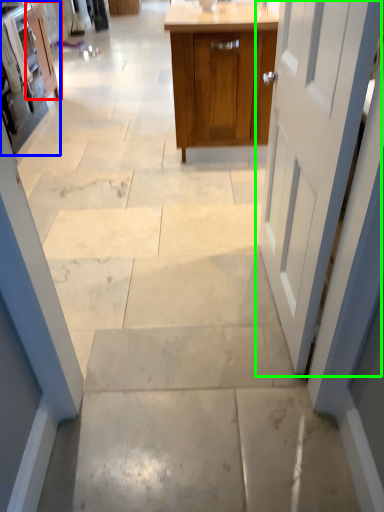
Question: Considering the real-world distances, which object is farthest from cabinetry (highlighted by a red box)? cabinetry (highlighted by a blue box) or door (highlighted by a green box)?

Choices:
 (A) cabinetry
 (B) door

Answer: (B)